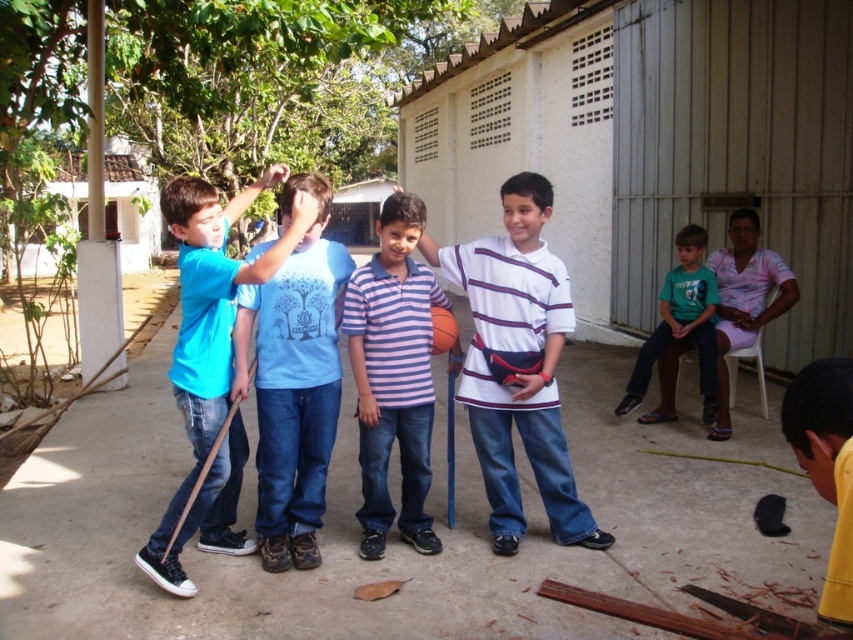
Consider the image. Based on the provided scene description, where exactly is the white striped shirt at center located in the image?

The white striped shirt at center is located at point coordinates of 0.570 on the x axis and 0.607 on the y axis.

You are a photographer trying to capture a group photo of the white striped shirt at center and the matte blue shirt at center. If you want to ensure both subjects are fully visible in the frame without cropping any part of them, which subject requires a wider angle lens to accommodate their larger size?

The white striped shirt at center requires a wider angle lens because its width is larger than the matte blue shirt at center, allowing the photographer to capture the entire subject without cropping.